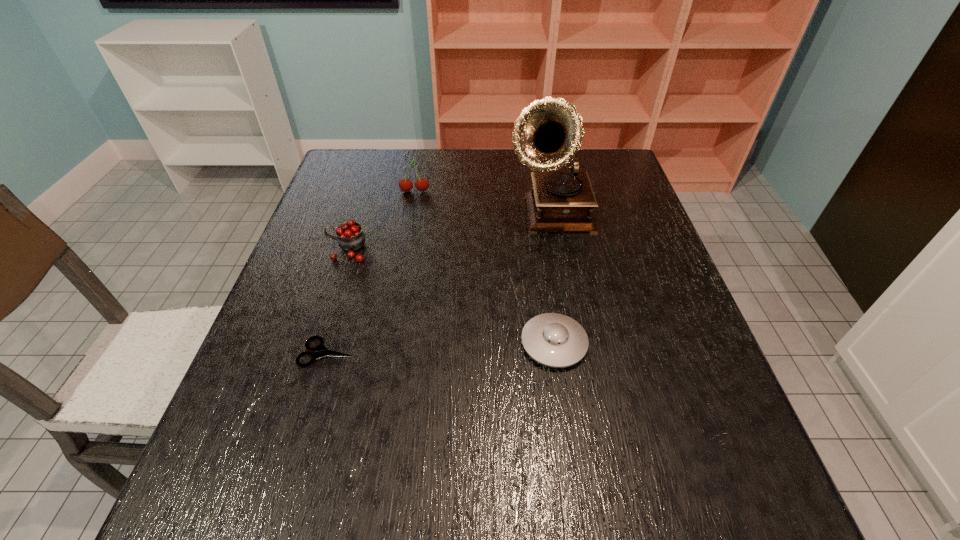
Where is `record player`? Image resolution: width=960 pixels, height=540 pixels. record player is located at coordinates (548, 133).

The image size is (960, 540). Identify the location of the farther cherry. (421, 184).

Identify the location of the third object from left to right. This screenshot has width=960, height=540. (421, 184).

This screenshot has height=540, width=960. Find the location of `the nearer cherry`. the nearer cherry is located at coordinates (350, 237).

Locate an element on the screen. The width and height of the screenshot is (960, 540). saucer is located at coordinates (555, 340).

You are a GUI agent. You are given a task and a screenshot of the screen. Output one action in this format:
    pyautogui.click(x=<x>, y=<y>)
    Task: Click on the shortest object
    The image size is (960, 540).
    Given the screenshot: What is the action you would take?
    pyautogui.click(x=321, y=351)

You are a GUI agent. You are given a task and a screenshot of the screen. Output one action in this format:
    pyautogui.click(x=<x>, y=<y>)
    Task: Click on the vacant space located on the horn of the record player
    
    Given the screenshot: What is the action you would take?
    pyautogui.click(x=566, y=286)

Find the location of a particular element. This screenshot has width=960, height=540. free space located on the surface of the farther cherry is located at coordinates (399, 275).

Where is `vacant region located 0.100m on the back of the second shortest object`? Image resolution: width=960 pixels, height=540 pixels. vacant region located 0.100m on the back of the second shortest object is located at coordinates (545, 285).

Find the location of a particular element. Image resolution: width=960 pixels, height=540 pixels. vacant space located 0.130m on the front of the shears is located at coordinates (305, 433).